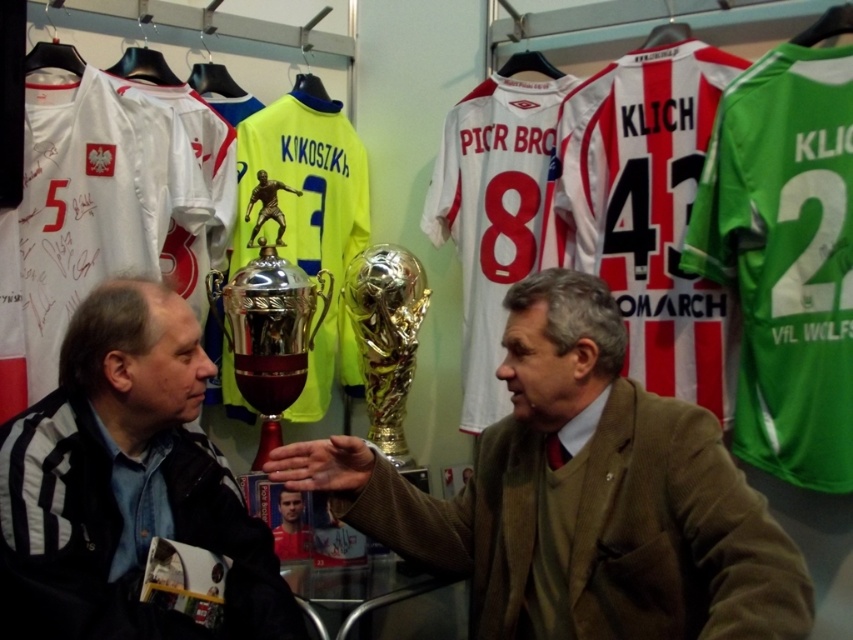
Which is more to the left, black leather jacket at center or silver/metallic trophy at center?

From the viewer's perspective, black leather jacket at center appears more on the left side.

Who is more forward, (49, 538) or (277, 387)?

Positioned in front is point (49, 538).

Where is `black leather jacket at center`? Image resolution: width=853 pixels, height=640 pixels. black leather jacket at center is located at coordinates (125, 483).

Between brown woolen jacket at center and gold metallic trophy at center, which one has more height?

With more height is brown woolen jacket at center.

Is point (578, 483) behind point (360, 266)?

No, it is in front of (360, 266).

The height and width of the screenshot is (640, 853). Find the location of `brown woolen jacket at center`. brown woolen jacket at center is located at coordinates (582, 497).

Does brown woolen jacket at center have a smaller size compared to silver/metallic trophy at center?

No, brown woolen jacket at center is not smaller than silver/metallic trophy at center.

Find the location of a particular element. This screenshot has width=853, height=640. brown woolen jacket at center is located at coordinates (582, 497).

Between point (566, 497) and point (318, 284), which one is positioned in front?

Point (566, 497) is in front.

Identify the location of brown woolen jacket at center. This screenshot has width=853, height=640. (582, 497).